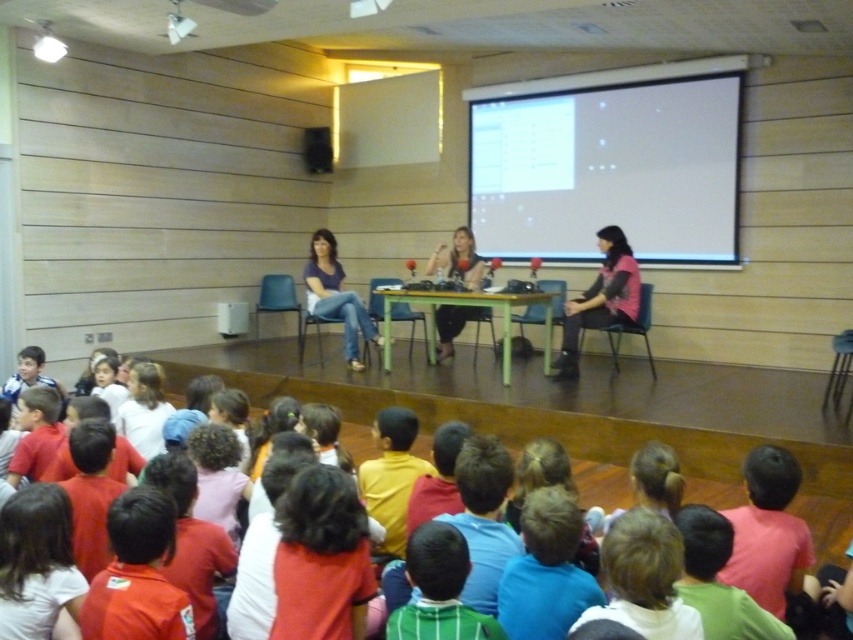
Question: Where is white matte projection screen at upper center located in relation to matte blue jeans at center in the image?

Choices:
 (A) below
 (B) above

Answer: (B)

Question: Is white matte projection screen at upper center above pink fabric shirt at center?

Choices:
 (A) yes
 (B) no

Answer: (A)

Question: Which of the following is the closest to the observer?

Choices:
 (A) (442, 323)
 (B) (622, 152)

Answer: (A)

Question: Which point is closer to the camera?

Choices:
 (A) white matte projection screen at upper center
 (B) matte blue jeans at center
 (C) pink fabric shirt at center
 (D) matte black table at center

Answer: (C)

Question: Can you confirm if pink fabric shirt at center is positioned to the left of matte blue jeans at center?

Choices:
 (A) yes
 (B) no

Answer: (B)

Question: Estimate the real-world distances between objects in this image. Which object is closer to the white matte projection screen at upper center?

Choices:
 (A) pink fabric shirt at center
 (B) matte black table at center

Answer: (A)